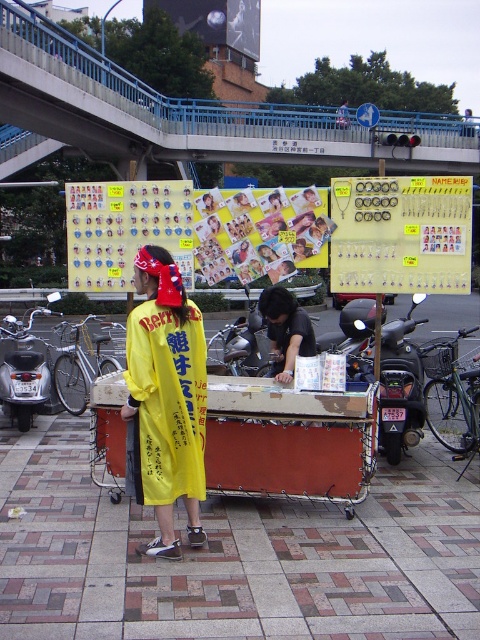
You are standing at the vendor stall and want to place a new item between the two points labeled point (108, 387) and point (417, 412). Which point should you place it closer to so that it is in front of the other point?

The point (108, 387) is in front of point (417, 412). Therefore, placing the item closer to point (108, 387) will ensure it is in front of point (417, 412).

You are a photographer trying to capture the entire scene of the concrete bridge at upper center and the yellow fabric shirt at center. Given that your camera can only focus on objects within a 1.5 meter width, will both objects fit in the frame?

The concrete bridge at upper center is larger than the yellow fabric shirt at center, so it might not fit within the 1.5 meter width frame. However, without specific measurements, it is uncertain.